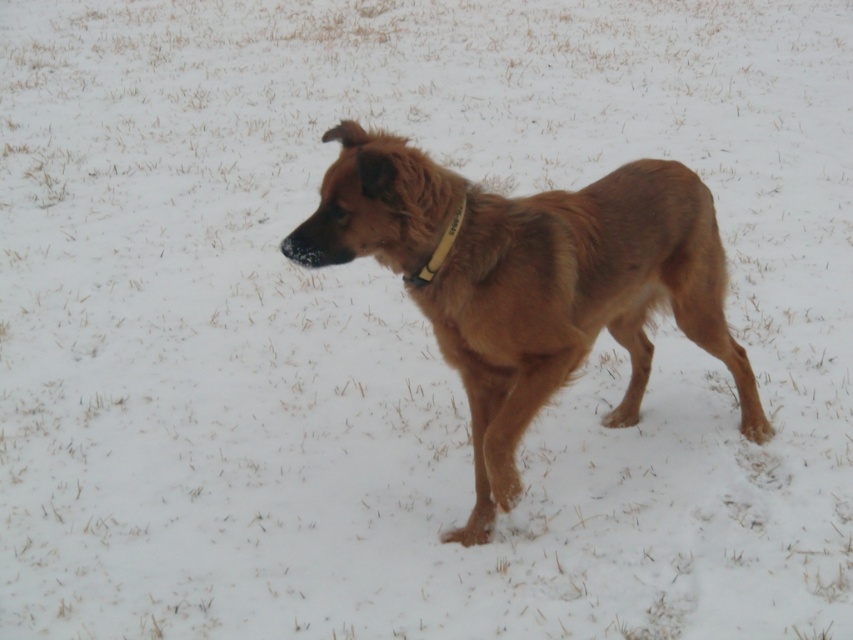
Question: Is brown furry dog at center to the right of yellow fabric neckband at center from the viewer's perspective?

Choices:
 (A) no
 (B) yes

Answer: (B)

Question: Can you confirm if brown furry dog at center is positioned to the right of yellow fabric neckband at center?

Choices:
 (A) yes
 (B) no

Answer: (A)

Question: Is brown furry dog at center behind yellow fabric neckband at center?

Choices:
 (A) yes
 (B) no

Answer: (B)

Question: Which point is farther to the camera?

Choices:
 (A) yellow fabric neckband at center
 (B) brown furry dog at center

Answer: (A)